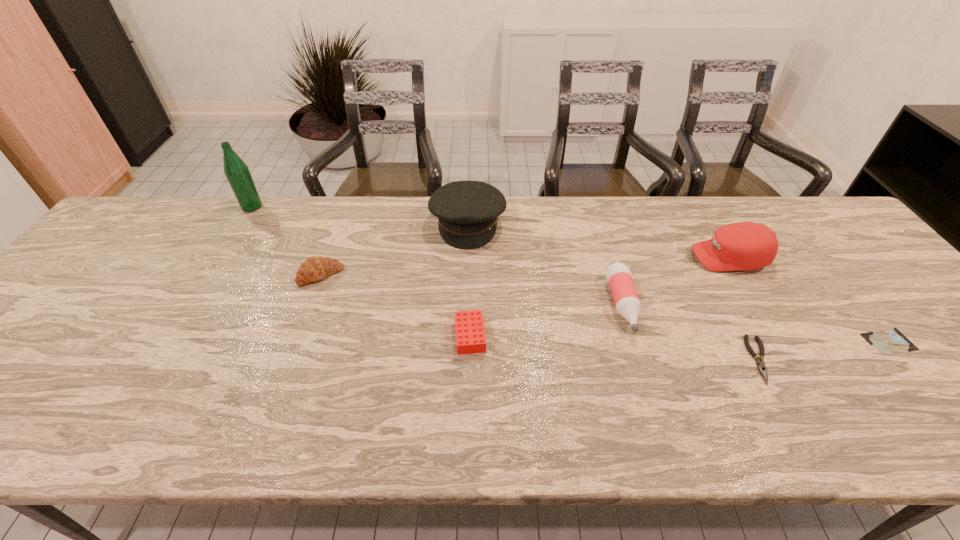
Locate an element on the screen. vacant space located on the left of the pliers is located at coordinates (725, 360).

Identify the location of vacant space located on the left of the rightmost object. (697, 341).

This screenshot has height=540, width=960. In order to click on bottle positioned at the far edge in this screenshot , I will do `click(237, 173)`.

This screenshot has width=960, height=540. Find the location of `beret located at the far edge`. beret located at the far edge is located at coordinates (467, 211).

Where is `cap that is at the far edge`? Image resolution: width=960 pixels, height=540 pixels. cap that is at the far edge is located at coordinates [745, 245].

The width and height of the screenshot is (960, 540). In order to click on object that is at the right edge in this screenshot , I will do `click(891, 341)`.

Where is `free space at the far edge of the desktop`? Image resolution: width=960 pixels, height=540 pixels. free space at the far edge of the desktop is located at coordinates (692, 202).

Where is `vacant space at the near edge of the desktop`? The height and width of the screenshot is (540, 960). vacant space at the near edge of the desktop is located at coordinates (877, 420).

This screenshot has width=960, height=540. I want to click on vacant position at the far right corner of the desktop, so click(776, 199).

Identify the location of vacant point located between the rightmost object and the fifth shortest object. The image size is (960, 540). (756, 323).